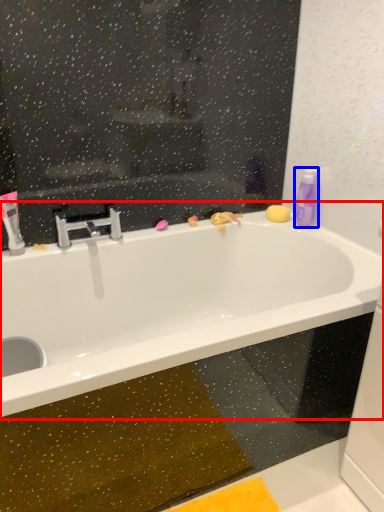
Question: Which point is closer to the camera, bathtub (highlighted by a red box) or cleaning product (highlighted by a blue box)?

Choices:
 (A) bathtub
 (B) cleaning product

Answer: (A)